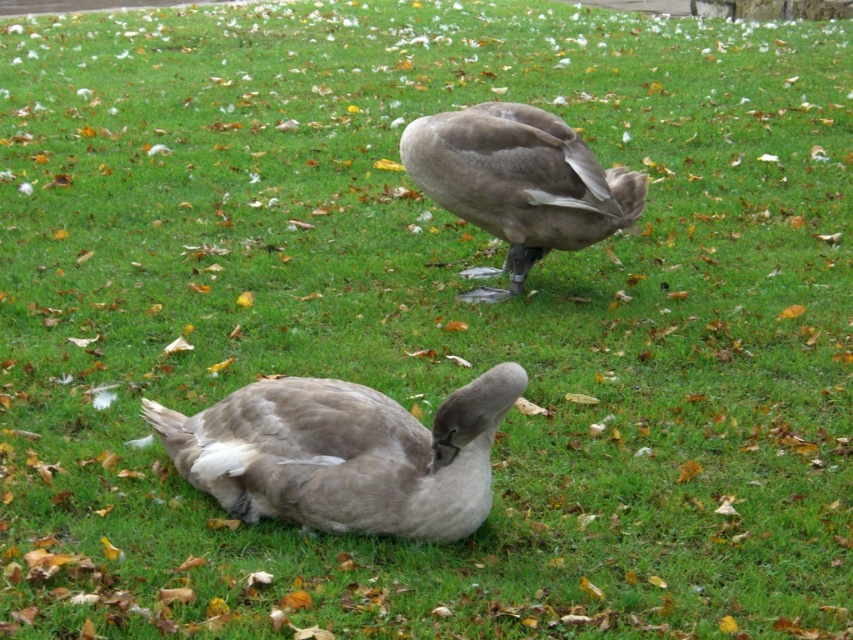
Question: Can you confirm if gray matte duck at lower left is positioned above gray matte duck at center?

Choices:
 (A) yes
 (B) no

Answer: (B)

Question: Which point is closer to the camera taking this photo?

Choices:
 (A) (218, 500)
 (B) (592, 189)

Answer: (A)

Question: Is gray matte duck at lower left bigger than gray matte duck at center?

Choices:
 (A) yes
 (B) no

Answer: (B)

Question: Is gray matte duck at lower left to the left of gray matte duck at center from the viewer's perspective?

Choices:
 (A) no
 (B) yes

Answer: (B)

Question: Which object appears closest to the camera in this image?

Choices:
 (A) gray matte duck at lower left
 (B) gray matte duck at center

Answer: (A)